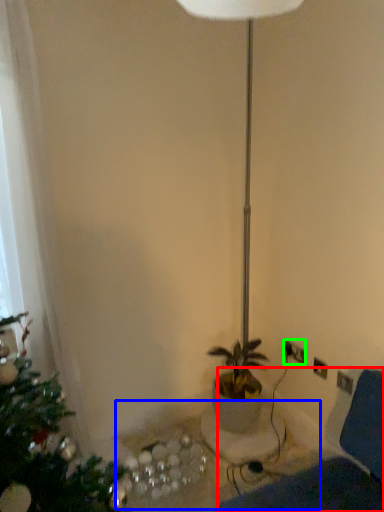
Question: Which object is the farthest from swivel chair (highlighted by a red box)? Choose among these: table (highlighted by a blue box) or electric outlet (highlighted by a green box).

Choices:
 (A) table
 (B) electric outlet

Answer: (B)